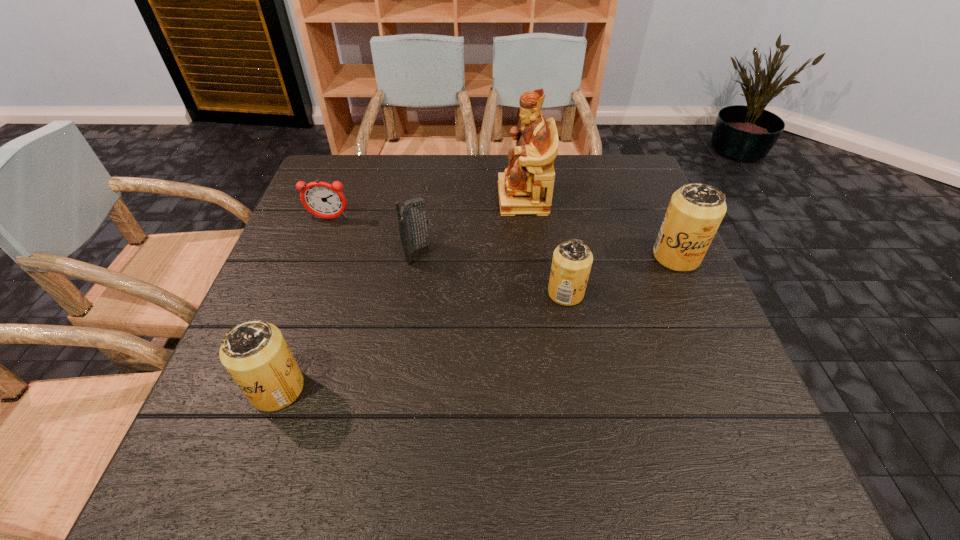
Where is `the nearest beer can`? Image resolution: width=960 pixels, height=540 pixels. the nearest beer can is located at coordinates click(x=255, y=353).

This screenshot has height=540, width=960. I want to click on the second shortest beer can, so click(x=255, y=353).

The height and width of the screenshot is (540, 960). In order to click on the shortest beer can in this screenshot , I will do `click(572, 260)`.

The height and width of the screenshot is (540, 960). I want to click on the second beer can from right to left, so click(572, 260).

Identify the location of the farthest beer can. The width and height of the screenshot is (960, 540). (695, 211).

The height and width of the screenshot is (540, 960). I want to click on the rightmost object, so click(x=695, y=211).

In order to click on the tallest object in this screenshot , I will do `click(526, 187)`.

You are a GUI agent. You are given a task and a screenshot of the screen. Output one action in this format:
    pyautogui.click(x=<x>, y=<y>)
    Task: Click on the alarm clock
    
    Given the screenshot: What is the action you would take?
    pyautogui.click(x=321, y=199)

The width and height of the screenshot is (960, 540). In order to click on the fourth object from right to left in this screenshot , I will do (413, 225).

This screenshot has height=540, width=960. I want to click on vacant area situated 0.280m on the back of the nearest beer can, so click(322, 265).